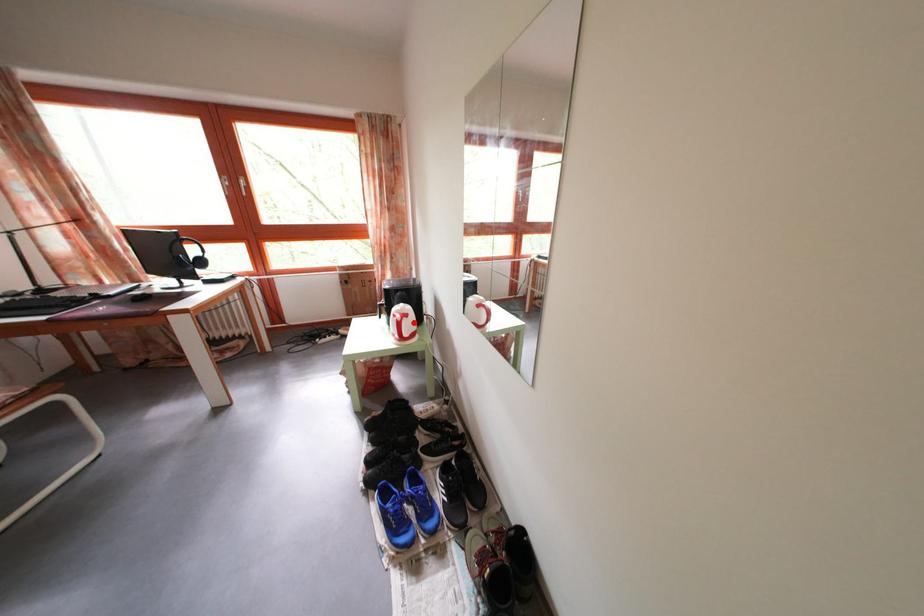
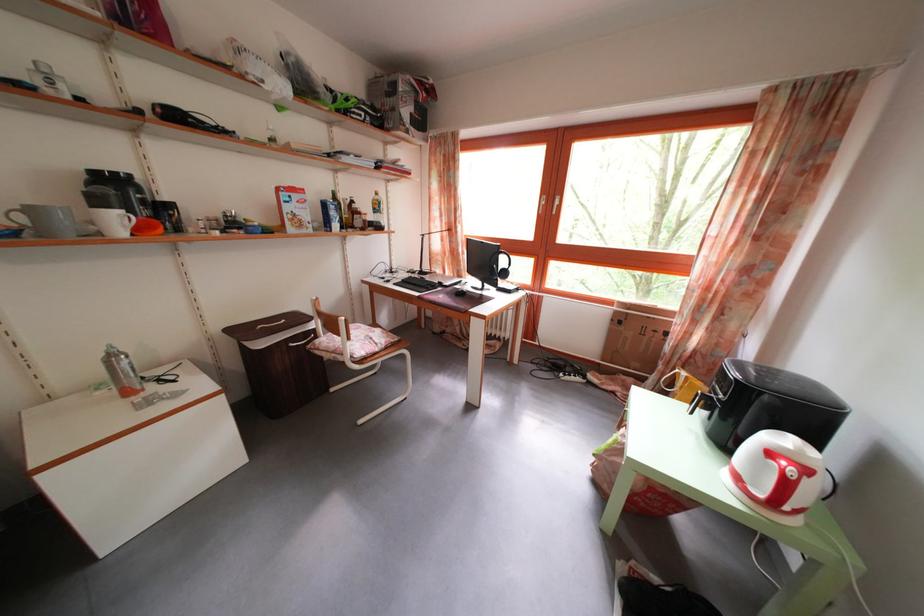
The point at the highlighted location is marked in the first image. Where is the corresponding point in the second image?

(812, 477)